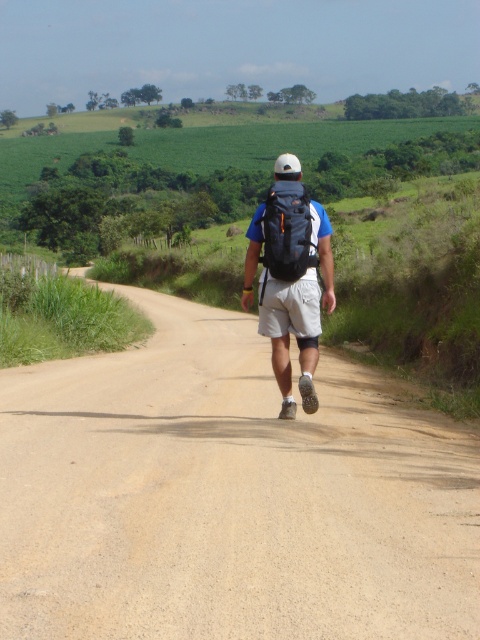
Question: Which object is the closest to the orange mesh backpack at center?

Choices:
 (A) brown gravel road at center
 (B) matte black backpack at center

Answer: (A)

Question: Which point is closer to the camera?

Choices:
 (A) (305, 288)
 (B) (282, 180)
 (C) (202, 369)

Answer: (A)

Question: Can you confirm if brown gravel road at center is bigger than orange mesh backpack at center?

Choices:
 (A) yes
 (B) no

Answer: (A)

Question: Is matte black backpack at center positioned behind orange mesh backpack at center?

Choices:
 (A) yes
 (B) no

Answer: (B)

Question: Can you confirm if brown gravel road at center is wider than orange mesh backpack at center?

Choices:
 (A) no
 (B) yes

Answer: (B)

Question: Which point is closer to the camera?

Choices:
 (A) orange mesh backpack at center
 (B) matte black backpack at center

Answer: (B)